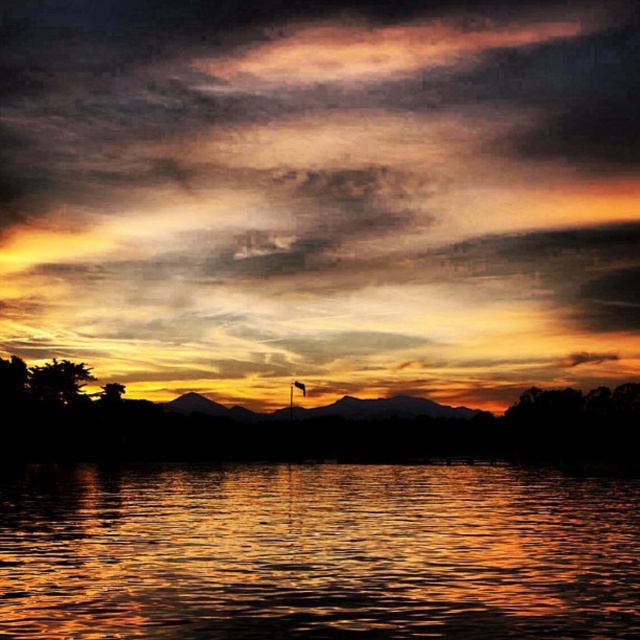
Between matte orange sky at center and shiny reflective water at center, which one has more height?

matte orange sky at center

Is matte orange sky at center behind shiny reflective water at center?

Yes, it is.

You are a GUI agent. You are given a task and a screenshot of the screen. Output one action in this format:
    pyautogui.click(x=<x>, y=<y>)
    Task: Click on the matte orange sky at center
    The width and height of the screenshot is (640, 640).
    Given the screenshot: What is the action you would take?
    pyautogui.click(x=321, y=195)